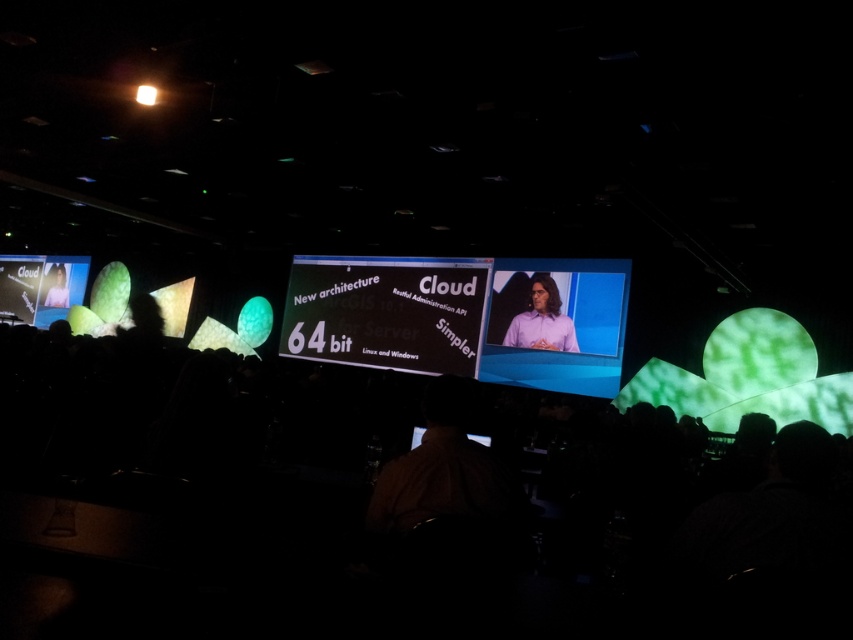
Can you confirm if white glossy projector screen at center is positioned to the right of purple shirt at center?

Incorrect, white glossy projector screen at center is not on the right side of purple shirt at center.

Based on the photo, is white glossy projector screen at center above purple shirt at center?

Correct, white glossy projector screen at center is located above purple shirt at center.

Does point (309, 348) lie behind point (524, 320)?

Yes, it is.

Image resolution: width=853 pixels, height=640 pixels. In order to click on white glossy projector screen at center in this screenshot , I will do `click(386, 310)`.

Which is behind, point (13, 433) or point (439, 477)?

Point (13, 433)

Which is below, black fabric crowd at lower center or brown shirt at center?

black fabric crowd at lower center is below.

Which is in front, point (563, 627) or point (413, 512)?

Point (563, 627) is in front.

Locate an element on the screen. black fabric crowd at lower center is located at coordinates (354, 522).

Between black fabric crowd at lower center and matte black laptop at left, which one appears on the left side from the viewer's perspective?

Positioned to the left is matte black laptop at left.

From the picture: Is the position of black fabric crowd at lower center more distant than that of matte black laptop at left?

No, black fabric crowd at lower center is in front of matte black laptop at left.

Which is behind, point (166, 604) or point (67, 276)?

Positioned behind is point (67, 276).

You are a GUI agent. You are given a task and a screenshot of the screen. Output one action in this format:
    pyautogui.click(x=<x>, y=<y>)
    Task: Click on the black fabric crowd at lower center
    
    Given the screenshot: What is the action you would take?
    pyautogui.click(x=354, y=522)